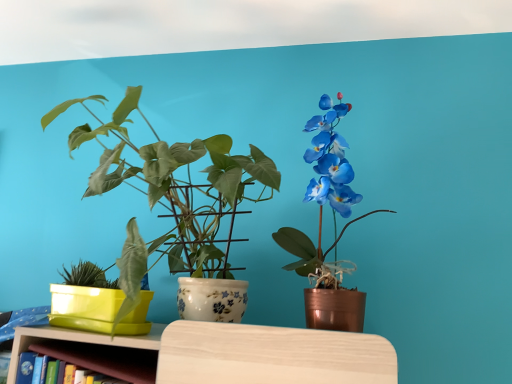
Question: Is wooden shelf at lower left facing towards matte white pot at center, which is the second houseplant from left to right?

Choices:
 (A) no
 (B) yes

Answer: (A)

Question: From the image's perspective, is wooden shelf at lower left above matte white pot at center, which is the second houseplant from left to right?

Choices:
 (A) yes
 (B) no

Answer: (B)

Question: Is wooden shelf at lower left behind matte white pot at center, which appears as the second houseplant when viewed from the right?

Choices:
 (A) no
 (B) yes

Answer: (B)

Question: From the image's perspective, would you say wooden shelf at lower left is shown under matte white pot at center, which appears as the second houseplant when viewed from the right?

Choices:
 (A) no
 (B) yes

Answer: (B)

Question: Is wooden shelf at lower left wider than matte white pot at center, which appears as the second houseplant when viewed from the right?

Choices:
 (A) yes
 (B) no

Answer: (B)

Question: Is wooden shelf at lower left positioned in front of matte white pot at center, which appears as the second houseplant when viewed from the right?

Choices:
 (A) yes
 (B) no

Answer: (B)

Question: Considering the relative positions of matte copper pot at right, the third houseplant when ordered from left to right, and matte yellow plastic pot at left, the first houseplant from the left, in the image provided, is matte copper pot at right, the third houseplant when ordered from left to right, to the left of matte yellow plastic pot at left, the first houseplant from the left, from the viewer's perspective?

Choices:
 (A) no
 (B) yes

Answer: (A)

Question: Could you tell me if matte copper pot at right, the first houseplant in the right-to-left sequence, is facing matte yellow plastic pot at left, positioned as the 3th houseplant in right-to-left order?

Choices:
 (A) no
 (B) yes

Answer: (A)

Question: From the image's perspective, is matte copper pot at right, the first houseplant in the right-to-left sequence, located beneath matte yellow plastic pot at left, positioned as the 3th houseplant in right-to-left order?

Choices:
 (A) yes
 (B) no

Answer: (B)

Question: Can you confirm if matte copper pot at right, the third houseplant when ordered from left to right, is bigger than matte yellow plastic pot at left, the first houseplant from the left?

Choices:
 (A) yes
 (B) no

Answer: (A)

Question: From a real-world perspective, does matte copper pot at right, the first houseplant in the right-to-left sequence, sit lower than matte yellow plastic pot at left, positioned as the 3th houseplant in right-to-left order?

Choices:
 (A) no
 (B) yes

Answer: (A)

Question: Is matte copper pot at right, the third houseplant when ordered from left to right, facing away from matte yellow plastic pot at left, positioned as the 3th houseplant in right-to-left order?

Choices:
 (A) no
 (B) yes

Answer: (A)

Question: From a real-world perspective, is matte white pot at center, which appears as the second houseplant when viewed from the right, positioned over matte copper pot at right, the third houseplant when ordered from left to right, based on gravity?

Choices:
 (A) no
 (B) yes

Answer: (A)